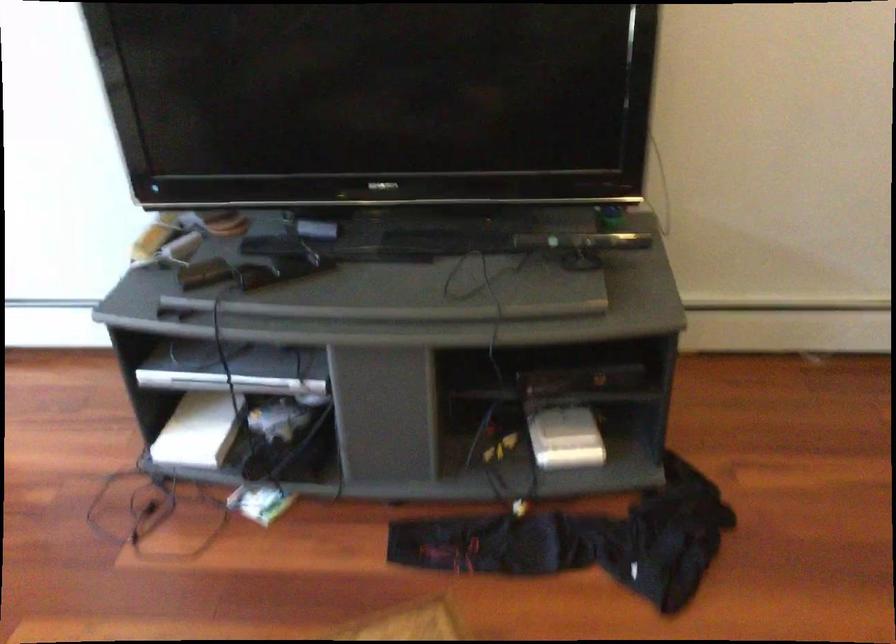
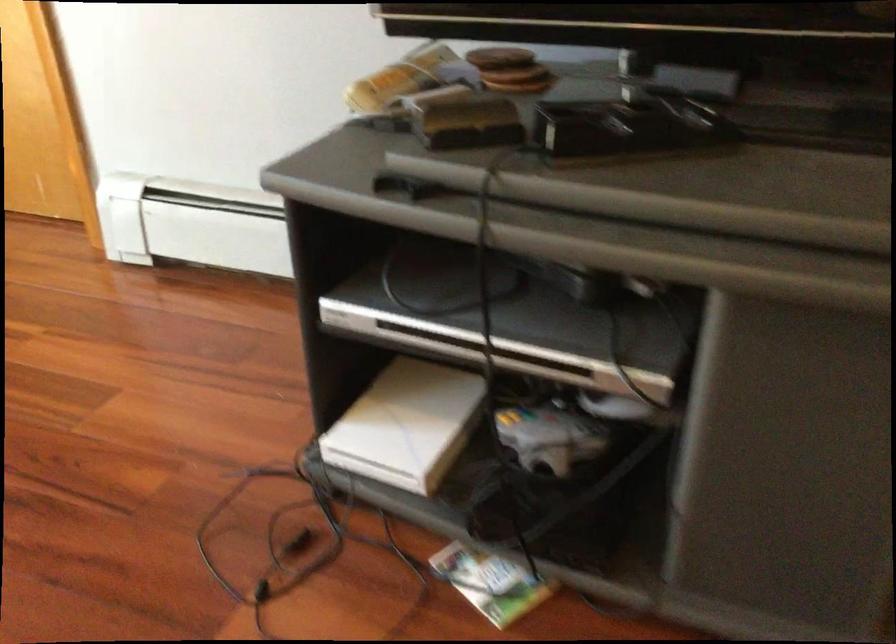
The point at (197,274) is marked in the first image. Where is the corresponding point in the second image?

(469, 124)